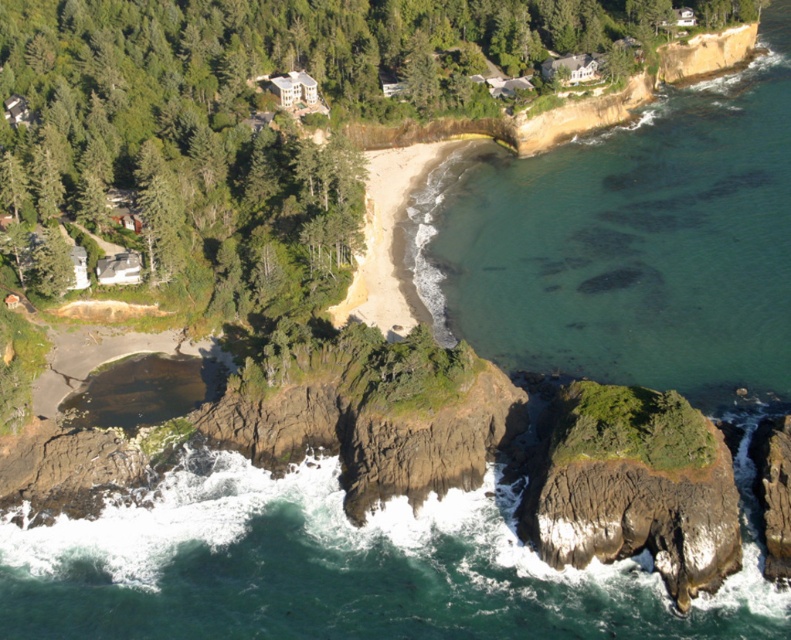
Is point (436, 204) positioned in front of point (532, 513)?

No, (436, 204) is further to viewer.

Who is positioned more to the left, clear water at upper right or rugged brown rock at lower right?

rugged brown rock at lower right is more to the left.

Locate an element on the screen. The height and width of the screenshot is (640, 791). clear water at upper right is located at coordinates (631, 243).

At what (x,y) coordinates should I click in order to perform the action: click on clear water at upper right. Please return your answer as a coordinate pair (x, y). Looking at the image, I should click on (631, 243).